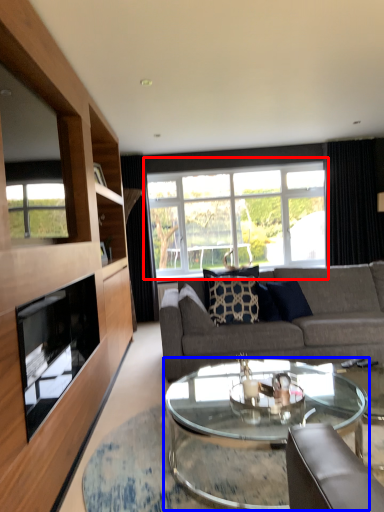
Question: Which point is closer to the camera, window (highlighted by a red box) or coffee table (highlighted by a blue box)?

Choices:
 (A) window
 (B) coffee table

Answer: (B)